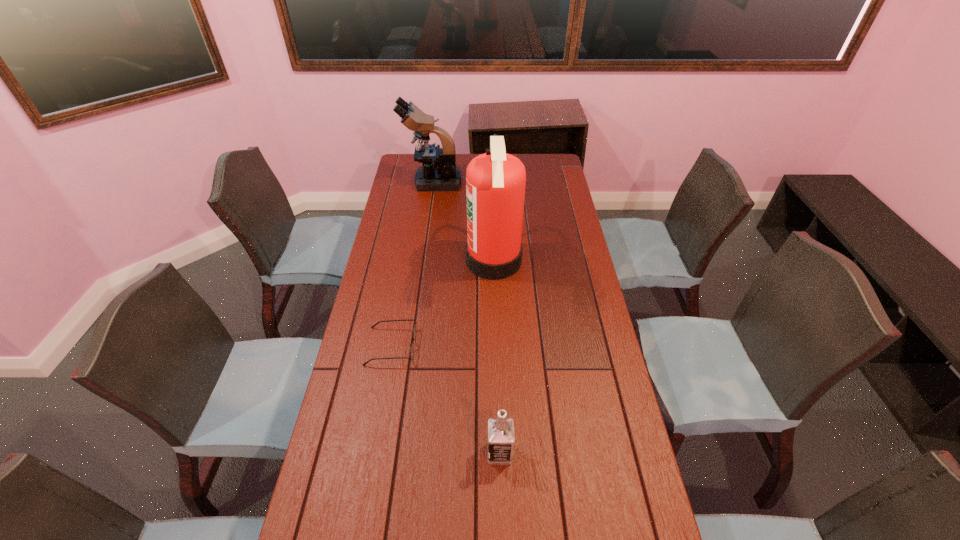
Locate an element on the screen. vacant space at the far edge is located at coordinates (519, 156).

Find the location of a particular element. The image size is (960, 540). free region at the left edge is located at coordinates (380, 468).

In the image, there is a desktop. Identify the location of vacant space at the right edge. This screenshot has height=540, width=960. (656, 535).

Where is `free space between the second farthest object and the farthest object`? The image size is (960, 540). free space between the second farthest object and the farthest object is located at coordinates (463, 221).

Image resolution: width=960 pixels, height=540 pixels. What are the coordinates of `free spot between the third tallest object and the third nearest object` in the screenshot? It's located at (496, 357).

This screenshot has height=540, width=960. In order to click on free space between the nearest object and the microscope in this screenshot , I will do click(467, 318).

This screenshot has height=540, width=960. Find the location of `free space between the fire extinguisher and the microscope`. free space between the fire extinguisher and the microscope is located at coordinates (463, 221).

Locate an element on the screen. This screenshot has height=540, width=960. object that is the second closest to the tallest object is located at coordinates (435, 174).

What are the coordinates of `object that stands as the second closest to the shortest object` in the screenshot? It's located at (501, 437).